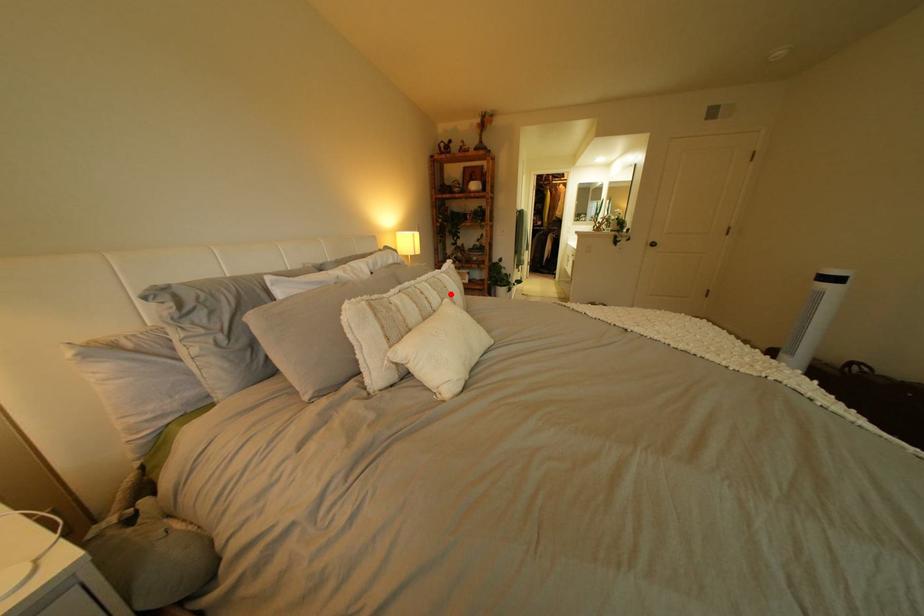
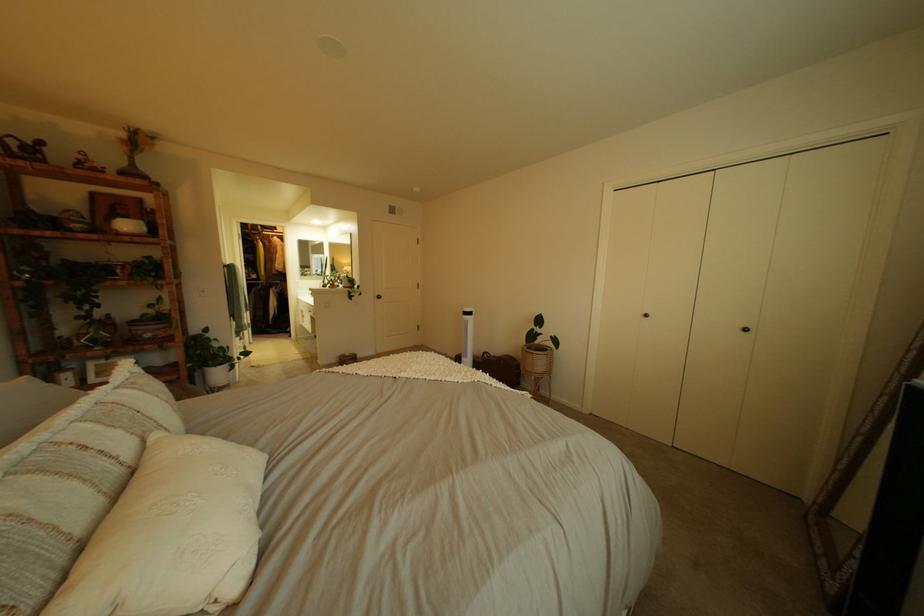
Find the pixel in the second image that matches the highlighted location in the first image.

(134, 434)